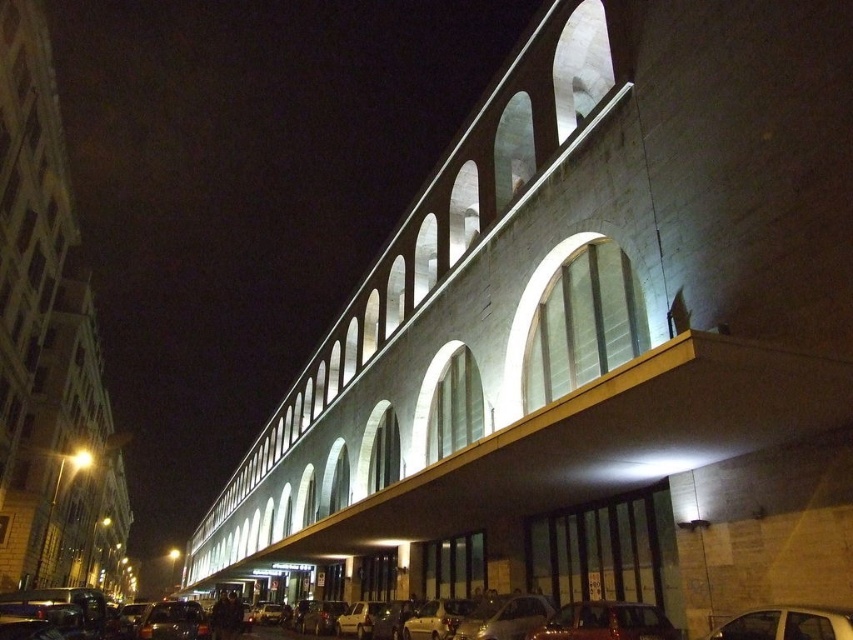
Question: Is matte white sedan at lower center below white glossy car at lower right?

Choices:
 (A) no
 (B) yes

Answer: (B)

Question: Which of the following is the farthest from the observer?

Choices:
 (A) shiny metallic car at lower center
 (B) matte white sedan at lower center
 (C) white glossy car at lower right
 (D) shiny black car at lower left

Answer: (D)

Question: Is matte white sedan at lower center bigger than white glossy car at lower right?

Choices:
 (A) no
 (B) yes

Answer: (B)

Question: Can you confirm if matte white sedan at lower center is positioned to the right of shiny black car at lower left?

Choices:
 (A) no
 (B) yes

Answer: (B)

Question: Which object appears closest to the camera in this image?

Choices:
 (A) matte white sedan at lower center
 (B) shiny black car at lower left
 (C) shiny metallic car at lower center

Answer: (A)

Question: Which of the following is the closest to the observer?

Choices:
 (A) matte white sedan at lower center
 (B) white glossy car at lower right
 (C) shiny black car at lower left

Answer: (B)